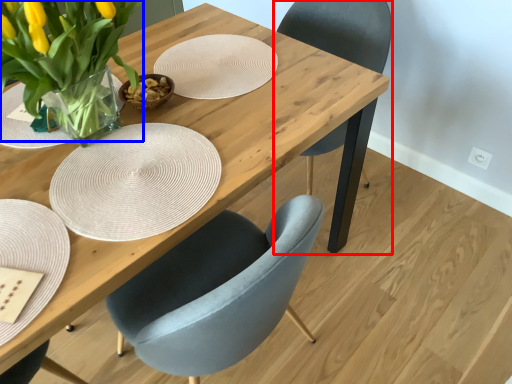
Question: Which object is closer to the camera taking this photo, chair (highlighted by a red box) or floral arrangement (highlighted by a blue box)?

Choices:
 (A) chair
 (B) floral arrangement

Answer: (B)